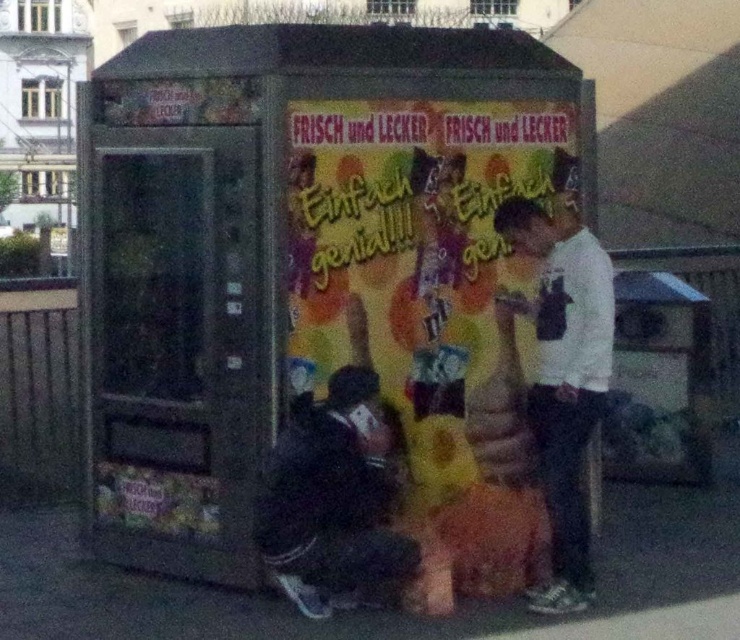
You are a delivery person who needs to place a large box on the surface between the metallic gray vending machine at center and the black fabric squat at lower center. Can you fit the box there?

The metallic gray vending machine at center is taller than the black fabric squat at lower center, so the surface between them might be level enough to place the box. However, the height difference could affect stability. Ensure the box is placed securely.

You are standing in front of the kiosk and want to know which of the two points, point (222,84) or point (319,508), is closer to you. Based on the description, which point is nearer?

Point (222,84) is further to the camera than point (319,508). Wait, the question asks which is closer to you. Since point (222,84) is further away, the closer one would be point (319,508). Hmm, but the answer should directly state the correct point. Let me rephrase. The Objects Description says point A is further than point B, so point B is closer. Therefore, the answer is point (319,508) is closer.